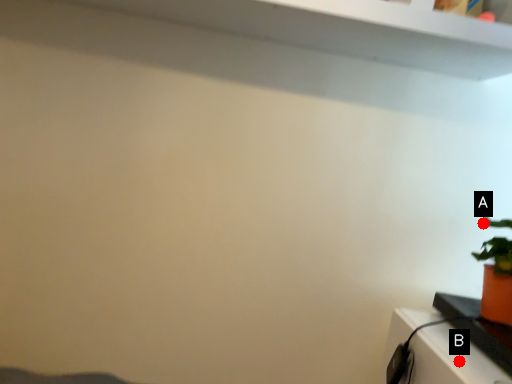
Question: Two points are circled on the image, labeled by A and B beside each circle. Which point is farther from the camera taking this photo?

Choices:
 (A) A is further
 (B) B is further

Answer: (A)